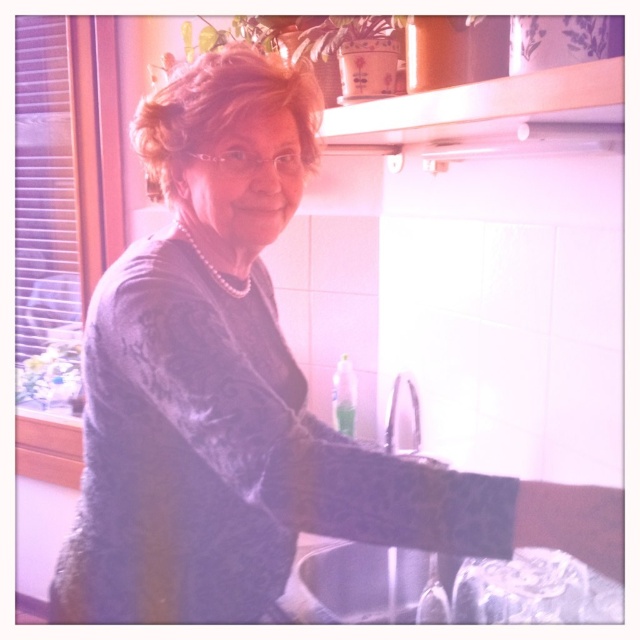
Measure the distance between matte gray sweater at center and black matte sink at lower center.

A distance of 17.92 inches exists between matte gray sweater at center and black matte sink at lower center.

Which is more to the right, matte gray sweater at center or black matte sink at lower center?

Positioned to the right is black matte sink at lower center.

The height and width of the screenshot is (640, 640). What are the coordinates of `matte gray sweater at center` in the screenshot? It's located at (198, 364).

Can you confirm if black matte sink at lower center is positioned below white glossy faucet at upper center?

Correct, black matte sink at lower center is located below white glossy faucet at upper center.

Can you confirm if black matte sink at lower center is smaller than white glossy faucet at upper center?

Actually, black matte sink at lower center might be larger than white glossy faucet at upper center.

What do you see at coordinates (369, 586) in the screenshot?
I see `black matte sink at lower center` at bounding box center [369, 586].

Locate an element on the screen. This screenshot has height=640, width=640. black matte sink at lower center is located at coordinates (369, 586).

Does matte gray sweater at center appear on the left side of white glossy faucet at upper center?

Indeed, matte gray sweater at center is positioned on the left side of white glossy faucet at upper center.

Is matte gray sweater at center taller than white glossy faucet at upper center?

Indeed, matte gray sweater at center has a greater height compared to white glossy faucet at upper center.

I want to click on matte gray sweater at center, so click(198, 364).